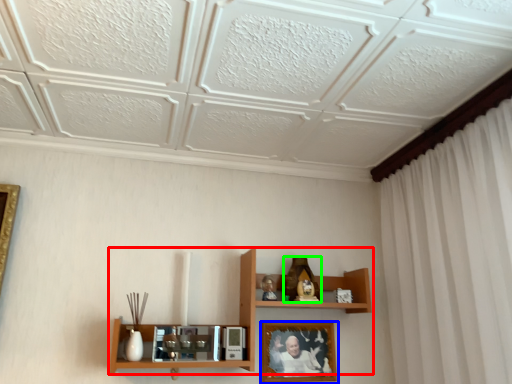
Question: Considering the real-world distances, which object is farthest from shelf (highlighted by a red box)? picture frame (highlighted by a blue box) or toy (highlighted by a green box)?

Choices:
 (A) picture frame
 (B) toy

Answer: (B)